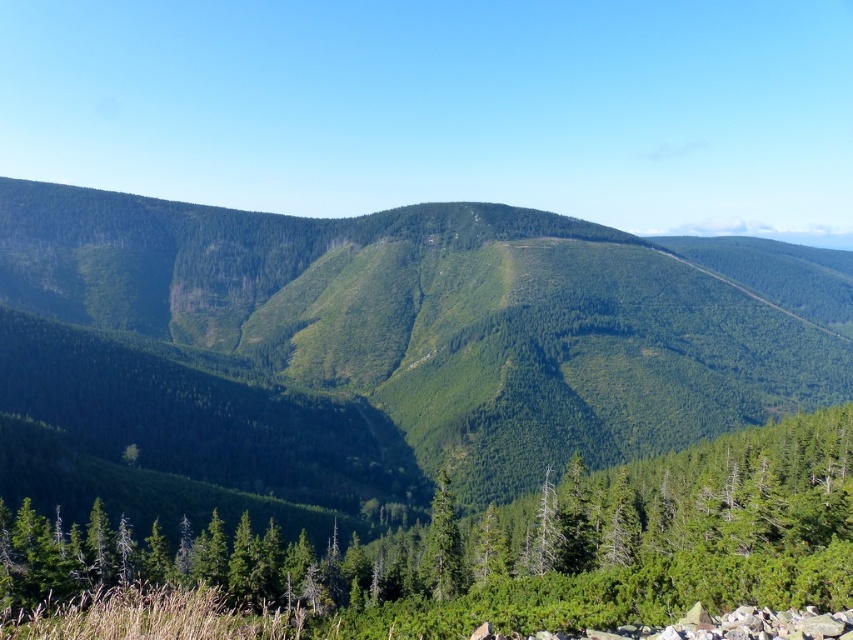
You are a hiker standing at the base of the green forested mountain at center and the green matte tree at lower center. Which object is closer to you?

The green matte tree at lower center is closer to you than the green forested mountain at center.

You are standing in the mountainous landscape and want to move from the point at coordinates point (358,388) to the point at coordinates point (432,545). Which direction should you head to get closer to your destination?

To move from point (358,388) to point (432,545), you should head towards the right and slightly forward since point (432,545) is further away from the viewer compared to point (358,388).

You are hiking through the mountainous landscape and want to reach the green matte tree at center. Which direction should you move relative to the green matte tree at lower center?

You should move away from the green matte tree at lower center because it is closer to you than the green matte tree at center, so going away from it would lead you toward the farther tree.